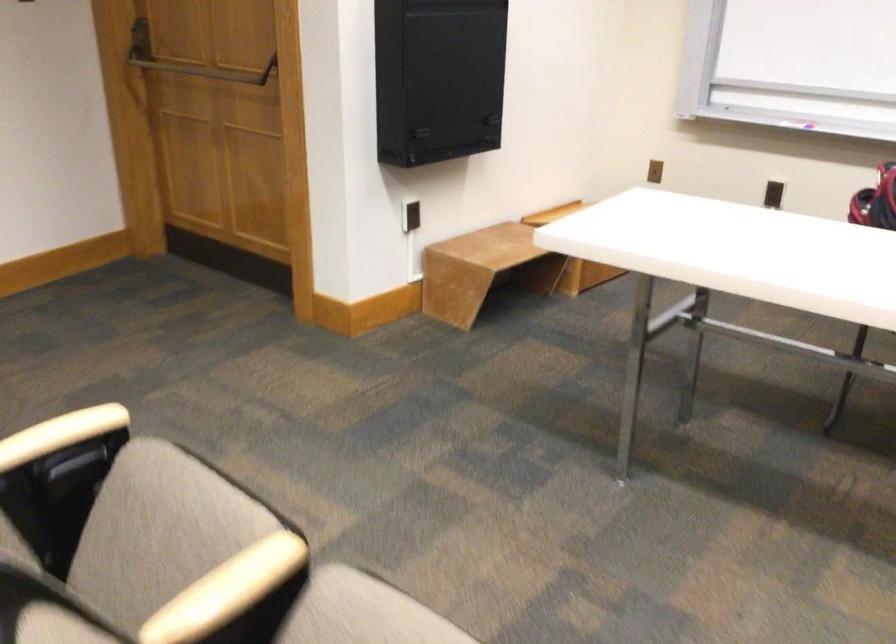
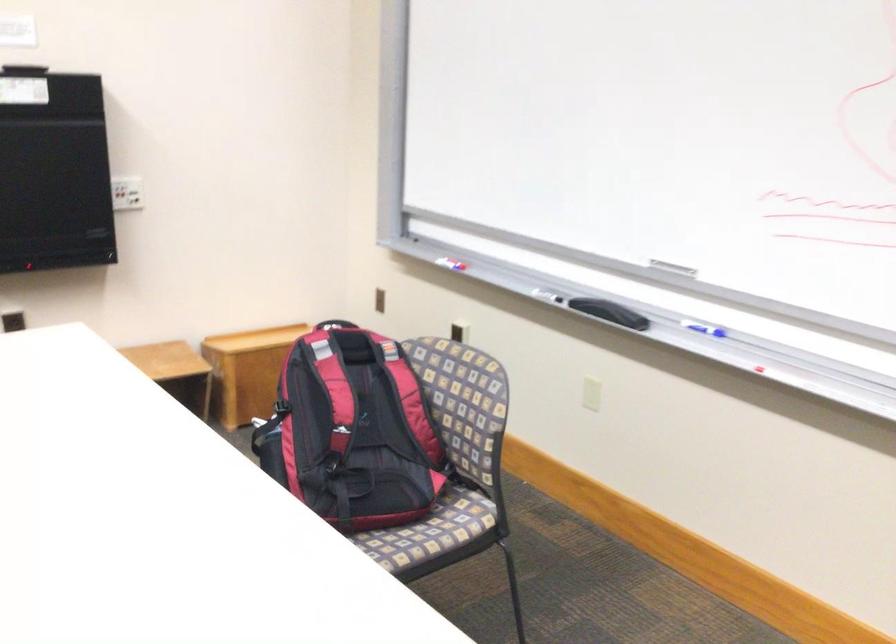
Question: In a continuous first-person perspective shot, in which direction is the camera moving?

Choices:
 (A) Left
 (B) Right
 (C) Forward
 (D) Backward

Answer: (B)